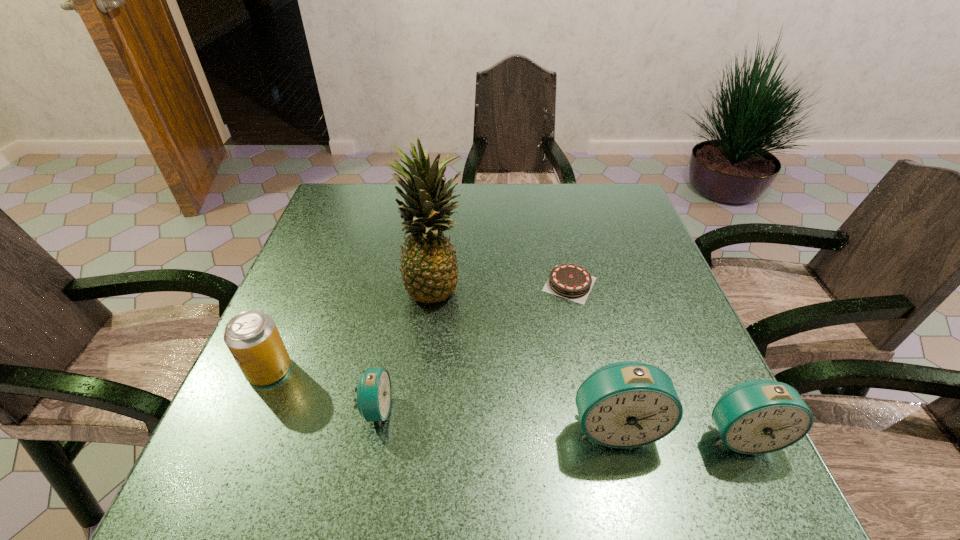
Identify the location of free spot located on the right of the pop (soda). (367, 370).

Where is `vacant space located 0.150m on the left of the tallest object`? This screenshot has height=540, width=960. vacant space located 0.150m on the left of the tallest object is located at coordinates (341, 287).

This screenshot has height=540, width=960. I want to click on object that is at the left edge, so click(252, 337).

Locate an element on the screen. free spot at the far edge of the desktop is located at coordinates (524, 198).

In the image, there is a desktop. In order to click on vacant space at the near edge in this screenshot , I will do `click(379, 438)`.

In the image, there is a desktop. Where is `vacant space at the left edge`? The image size is (960, 540). vacant space at the left edge is located at coordinates (248, 383).

I want to click on free space at the right edge of the desktop, so click(x=676, y=354).

Where is `blank space at the near left corner of the desktop`? The width and height of the screenshot is (960, 540). blank space at the near left corner of the desktop is located at coordinates pyautogui.click(x=267, y=441).

Identify the location of free space at the far right corner of the desktop. Image resolution: width=960 pixels, height=540 pixels. (601, 185).

The height and width of the screenshot is (540, 960). I want to click on free space that is in between the tallest object and the chocolate cake, so click(x=502, y=286).